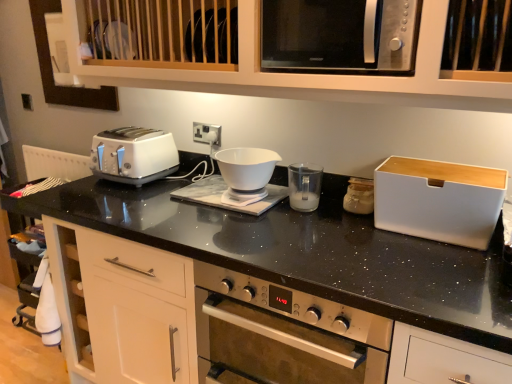
Image resolution: width=512 pixels, height=384 pixels. What do you see at coordinates (246, 173) in the screenshot? I see `white glossy bowl at center` at bounding box center [246, 173].

Describe the element at coordinates (304, 186) in the screenshot. I see `white plastic cup at center, arranged as the first appliance when viewed from the left` at that location.

Measure the distance between point (478, 245) and camera.

Point (478, 245) and camera are 4.16 feet apart.

Identify the location of satin silver microwave at upper center. (339, 36).

Image resolution: width=512 pixels, height=384 pixels. I want to click on metallic oven at center, so click(x=282, y=334).

Measure the distance between white glossy coffee machine at center and camera.

4.87 feet.

Where is `white glossy bowl at center`? Image resolution: width=512 pixels, height=384 pixels. white glossy bowl at center is located at coordinates (246, 173).

Which object is wider, white glossy coffee machine at center or matte glass jar at center-right, acting as the second appliance starting from the right?

With larger width is white glossy coffee machine at center.

Starting from the white glossy coffee machine at center, which appliance is the 2nd one to the right? Please provide its 2D coordinates.

[(359, 196)]

From the picture: Considering the sizes of objects white glossy coffee machine at center and matte glass jar at center-right, the second appliance when ordered from left to right, in the image provided, who is shorter, white glossy coffee machine at center or matte glass jar at center-right, the second appliance when ordered from left to right,?

white glossy coffee machine at center.

Between white glossy bowl at center and black plastic electric outlet at center, which one has more height?

Standing taller between the two is white glossy bowl at center.

Can you confirm if white glossy bowl at center is positioned to the left of black plastic electric outlet at center?

No, white glossy bowl at center is not to the left of black plastic electric outlet at center.

Considering the sizes of objects white glossy bowl at center and black plastic electric outlet at center in the image provided, who is wider, white glossy bowl at center or black plastic electric outlet at center?

white glossy bowl at center.

Considering the relative sizes of white glossy bowl at center and black plastic electric outlet at center in the image provided, is white glossy bowl at center bigger than black plastic electric outlet at center?

Yes, white glossy bowl at center is bigger than black plastic electric outlet at center.

From the image's perspective, is matte glass jar at center-right, acting as the second appliance starting from the right, under white plastic toaster at left?

Yes, from the image's perspective, matte glass jar at center-right, acting as the second appliance starting from the right, is beneath white plastic toaster at left.

From a real-world perspective, which object stands above the other?

From a 3D spatial view, white plastic toaster at left is above.

Looking at this image, is matte glass jar at center-right, the second appliance when ordered from left to right, wider or thinner than white plastic toaster at left?

matte glass jar at center-right, the second appliance when ordered from left to right, is thinner than white plastic toaster at left.

Is white plastic bread bin at right, the 3th appliance when ordered from left to right, inside the boundaries of metallic oven at center, or outside?

The correct answer is: outside.

Which of these two, white plastic bread bin at right, the 3th appliance when ordered from left to right, or metallic oven at center, is thinner?

white plastic bread bin at right, the 3th appliance when ordered from left to right.

Is metallic oven at center at the back of white plastic bread bin at right, marked as the first appliance in a right-to-left arrangement?

No.

Considering their positions, is white plastic bread bin at right, marked as the first appliance in a right-to-left arrangement, located in front of or behind metallic oven at center?

In the image, white plastic bread bin at right, marked as the first appliance in a right-to-left arrangement, appears behind metallic oven at center.

From a real-world perspective, is white plastic cup at center, arranged as the first appliance when viewed from the left, positioned over black plastic electric outlet at center based on gravity?

Actually, white plastic cup at center, arranged as the first appliance when viewed from the left, is physically below black plastic electric outlet at center in the real world.

Consider the image. Which object is positioned more to the left, white plastic cup at center, arranged as the first appliance when viewed from the left, or black plastic electric outlet at center?

From the viewer's perspective, black plastic electric outlet at center appears more on the left side.

In terms of width, does white plastic cup at center, arranged as the first appliance when viewed from the left, look wider or thinner when compared to black plastic electric outlet at center?

Considering their sizes, white plastic cup at center, arranged as the first appliance when viewed from the left, looks broader than black plastic electric outlet at center.

From the image's perspective, is white plastic cup at center, arranged as the first appliance when viewed from the left, over black plastic electric outlet at center?

No, from the image's perspective, white plastic cup at center, arranged as the first appliance when viewed from the left, is not above black plastic electric outlet at center.

Is the position of satin silver microwave at upper center less distant than that of white plastic toaster at left?

That is True.

From a real-world perspective, is satin silver microwave at upper center on top of white plastic toaster at left?

Yes, from a real-world perspective, satin silver microwave at upper center is over white plastic toaster at left

From the image's perspective, which is above, satin silver microwave at upper center or white plastic toaster at left?

satin silver microwave at upper center.

Is white glossy bowl at center positioned with its back to white plastic toaster at left?

No, white glossy bowl at center is not facing the opposite direction of white plastic toaster at left.

Considering their positions, is white glossy bowl at center located in front of or behind white plastic toaster at left?

white glossy bowl at center is positioned closer to the viewer than white plastic toaster at left.

Is white glossy bowl at center bigger or smaller than white plastic toaster at left?

white glossy bowl at center is smaller than white plastic toaster at left.

In order to click on the 2nd appliance in front of the white glossy coffee machine at center, starting your count from the anchor in this screenshot , I will do `click(359, 196)`.

Image resolution: width=512 pixels, height=384 pixels. Identify the location of electric outlet above the white glossy bowl at center (from the image's perspective). (207, 133).

From the picture: From the image, which object appears to be farther from white plastic cup at center, marked as the third appliance in a right-to-left arrangement, matte glass jar at center-right, acting as the second appliance starting from the right, or white plastic toaster at left?

The object further to white plastic cup at center, marked as the third appliance in a right-to-left arrangement, is white plastic toaster at left.

From the image, which object appears to be nearer to white plastic cup at center, marked as the third appliance in a right-to-left arrangement, matte glass jar at center-right, acting as the second appliance starting from the right, or black plastic electric outlet at center?

matte glass jar at center-right, acting as the second appliance starting from the right, lies closer to white plastic cup at center, marked as the third appliance in a right-to-left arrangement, than the other object.

Looking at the image, which one is located further to matte glass jar at center-right, the second appliance when ordered from left to right, white glossy bowl at center or metallic oven at center?

metallic oven at center is further to matte glass jar at center-right, the second appliance when ordered from left to right.

Consider the image. Which object lies further to the anchor point matte glass jar at center-right, the second appliance when ordered from left to right, white plastic toaster at left or white plastic cup at center, marked as the third appliance in a right-to-left arrangement?

Among the two, white plastic toaster at left is located further to matte glass jar at center-right, the second appliance when ordered from left to right.

Considering their positions, is white glossy coffee machine at center positioned closer to white glossy bowl at center than white plastic toaster at left?

Based on the image, white glossy coffee machine at center appears to be nearer to white glossy bowl at center.

Considering their positions, is white plastic cup at center, arranged as the first appliance when viewed from the left, positioned further to metallic oven at center than white plastic toaster at left?

white plastic toaster at left.

Considering their positions, is satin silver microwave at upper center positioned closer to white glossy bowl at center than matte glass jar at center-right, the second appliance when ordered from left to right?

matte glass jar at center-right, the second appliance when ordered from left to right, is closer to white glossy bowl at center.

From the image, which object appears to be farther from white glossy coffee machine at center, white plastic cup at center, arranged as the first appliance when viewed from the left, or white plastic toaster at left?

white plastic toaster at left is positioned further to the anchor white glossy coffee machine at center.

Find the location of `coffee machine located between white plastic toaster at left and matte glass jar at center-right, the second appliance when ordered from left to right, in the left-right direction`. coffee machine located between white plastic toaster at left and matte glass jar at center-right, the second appliance when ordered from left to right, in the left-right direction is located at coordinates (223, 195).

At what (x,y) coordinates should I click in order to perform the action: click on home appliance between white glossy coffee machine at center and white plastic bread bin at right, marked as the first appliance in a right-to-left arrangement, in the horizontal direction. Please return your answer as a coordinate pair (x, y). This screenshot has height=384, width=512. Looking at the image, I should click on (282, 334).

At what (x,y) coordinates should I click in order to perform the action: click on food processor located between black plastic electric outlet at center and white plastic bread bin at right, the 3th appliance when ordered from left to right, in the left-right direction. Please return your answer as a coordinate pair (x, y). The image size is (512, 384). Looking at the image, I should click on (246, 173).

Image resolution: width=512 pixels, height=384 pixels. Identify the location of toaster located between metallic oven at center and black plastic electric outlet at center in the depth direction. (133, 155).